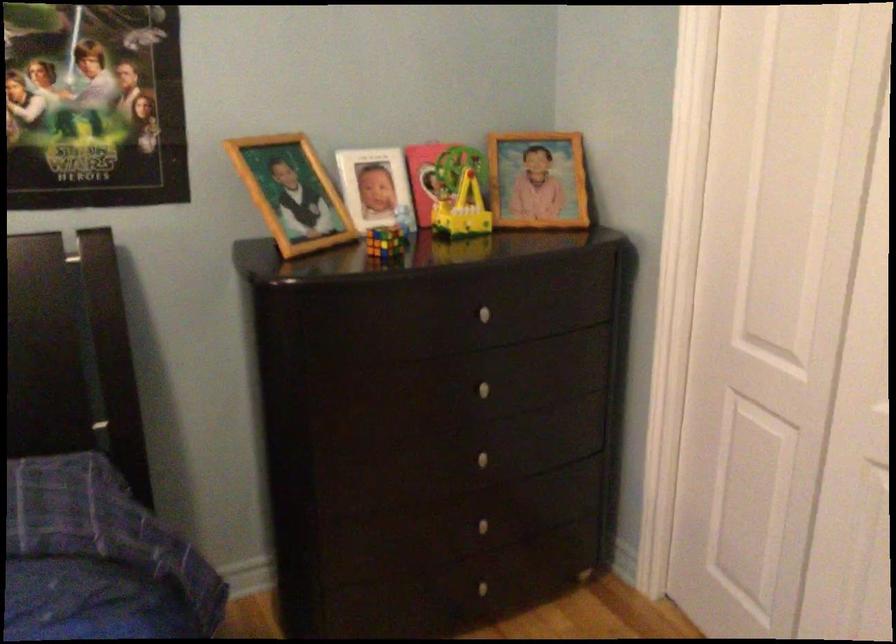
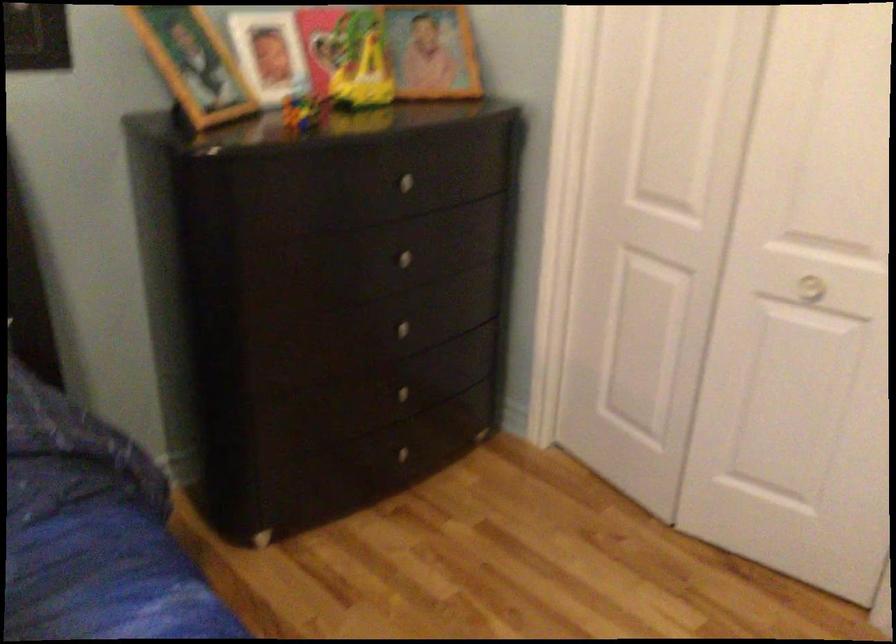
The point at (478, 525) is marked in the first image. Where is the corresponding point in the second image?

(400, 393)